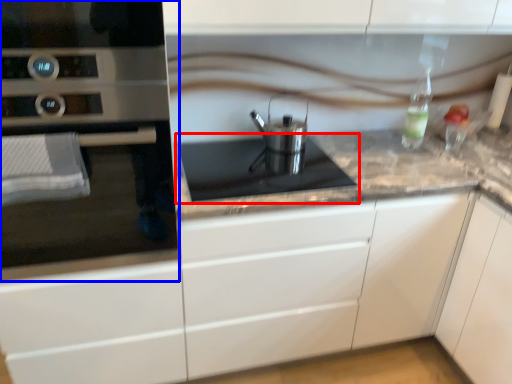
Question: Which point is closer to the camera, gas stove (highlighted by a red box) or home appliance (highlighted by a blue box)?

Choices:
 (A) gas stove
 (B) home appliance

Answer: (B)